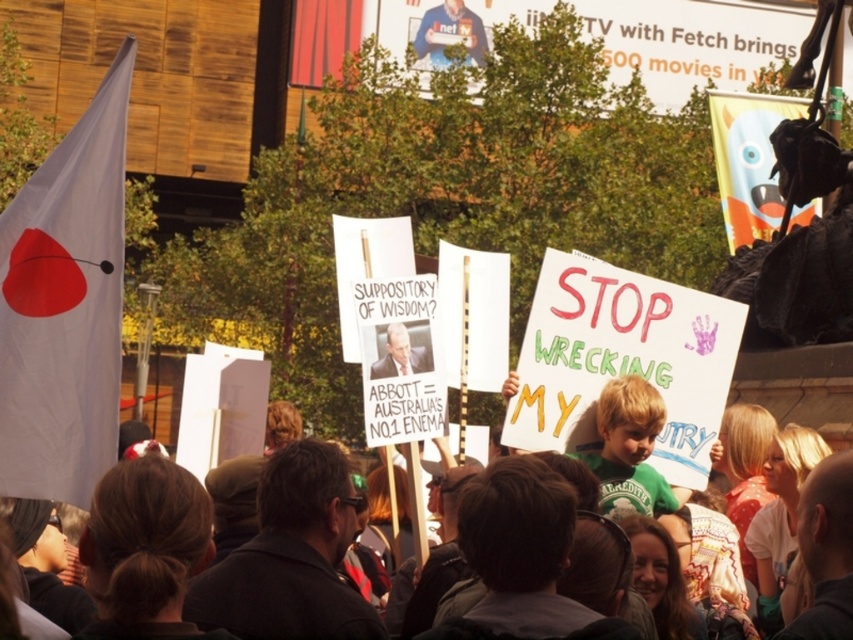
You are a photographer trying to capture the protest scene. You notice the blue shirt at upper center and the smooth plastic sign at center. Which object is narrower when viewed from your position?

The blue shirt at upper center is thinner than the smooth plastic sign at center, so the blue shirt at upper center is narrower.